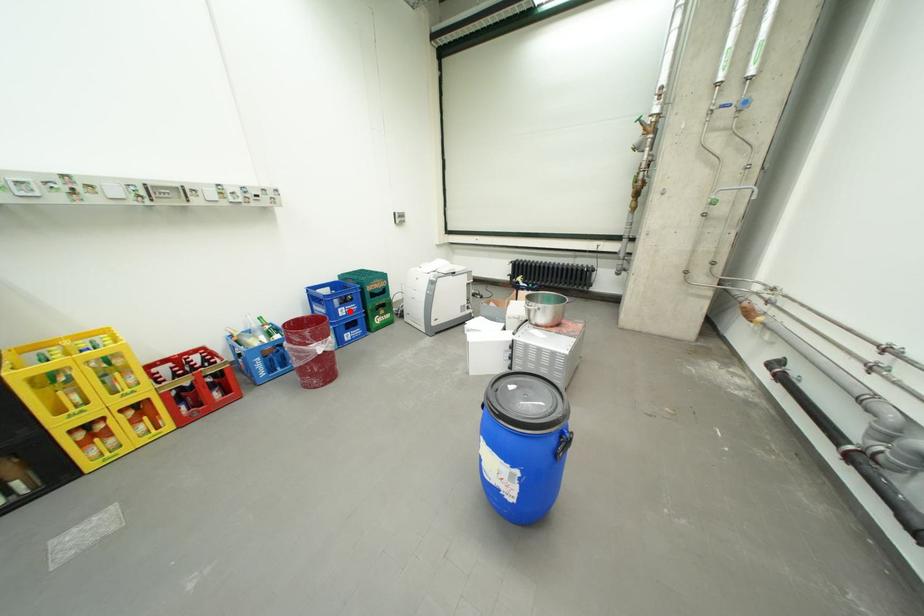
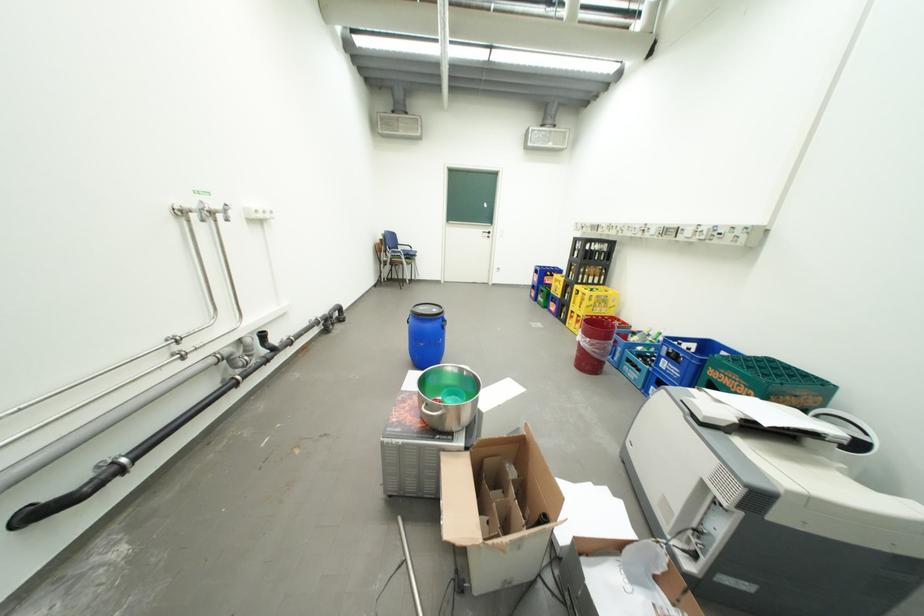
In the second image, find the point that corresponds to the highlighted location in the first image.

(674, 361)